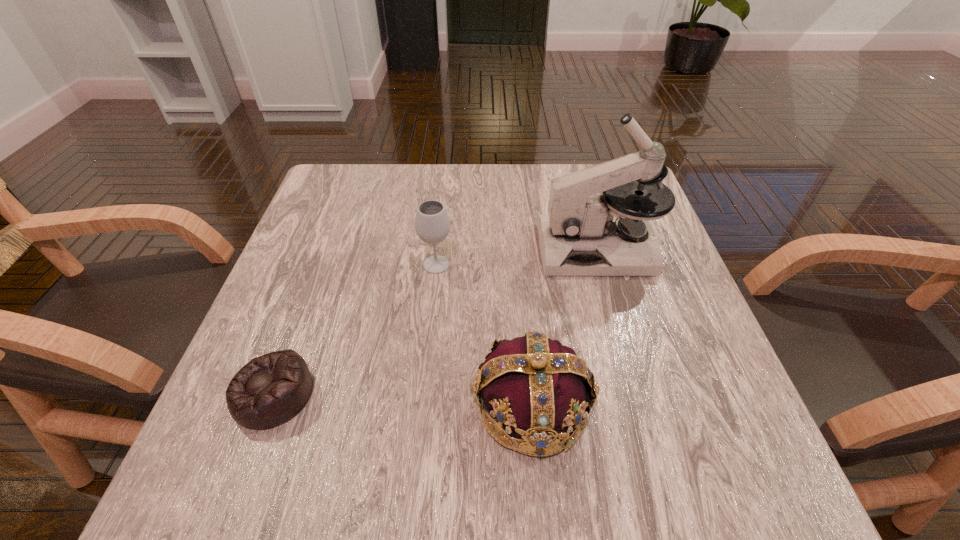
This screenshot has width=960, height=540. In order to click on unoccupied position between the crown and the wineglass in this screenshot , I will do `click(484, 335)`.

Identify the location of free point between the microscope and the beanbag. (436, 321).

Choose which object is the second nearest neighbor to the crown. Please provide its 2D coordinates. Your answer should be formatted as a tuple, i.e. [(x, y)], where the tuple contains the x and y coordinates of a point satisfying the conditions above.

[(432, 224)]

Identify which object is the third closest to the crown. Please provide its 2D coordinates. Your answer should be formatted as a tuple, i.e. [(x, y)], where the tuple contains the x and y coordinates of a point satisfying the conditions above.

[(270, 390)]